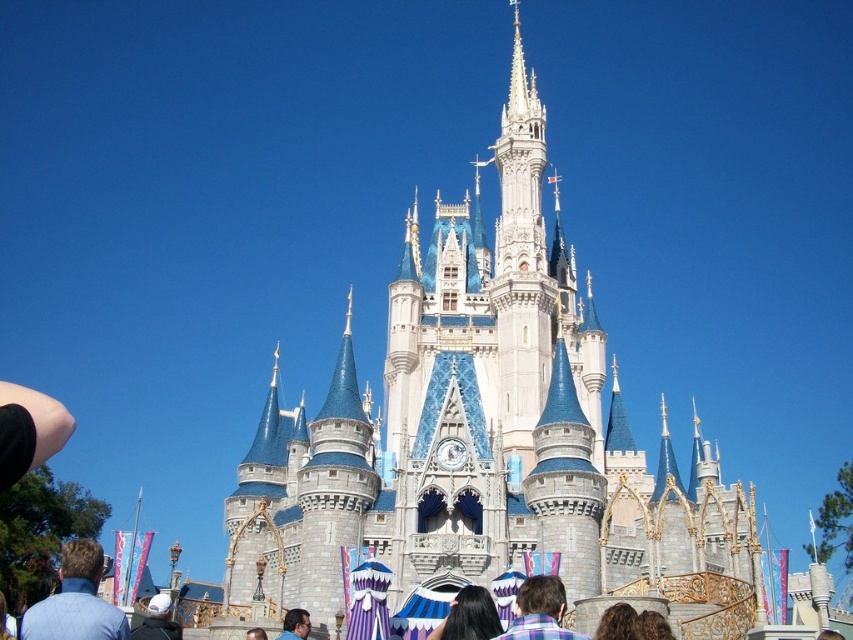
You are a photographer standing at the base of the castle, wanting to capture both the white matte helmet at lower left and the blue fabric headscarf at center in the same frame. Given that your camera has a fixed focal length, which object should you position closer to the center of the frame to ensure both are visible without zooming?

To ensure both the white matte helmet at lower left and the blue fabric headscarf at center are visible in the frame without zooming, position the blue fabric headscarf at center closer to the center of the frame. This is because the blue fabric headscarf at center is already centrally located, making it easier to include the white matte helmet at lower left in the shot by centering the headscarf. The distance between them is 8.36 meters, so adjusting the framing to center the headscarf would help capture a

You are a photographer standing in front of the castle and see the white matte helmet at lower left and the blue fabric headscarf at center. Which object is more to the left?

The white matte helmet at lower left is more to the left.